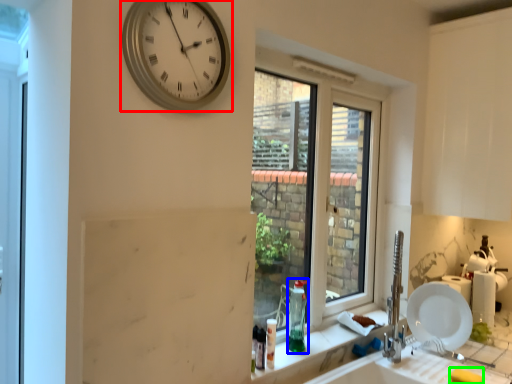
Question: Considering the real-world distances, which object is closest to wall clock (highlighted by a red box)? bottle (highlighted by a blue box) or soap (highlighted by a green box).

Choices:
 (A) bottle
 (B) soap

Answer: (A)